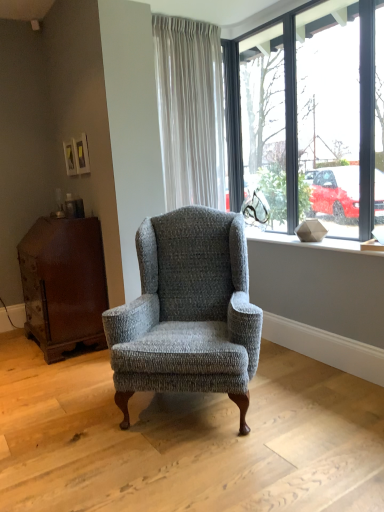
Locate an element on the screen. Image resolution: width=384 pixels, height=512 pixels. blank area to the left of textured gray wingback chair at center is located at coordinates (x=66, y=415).